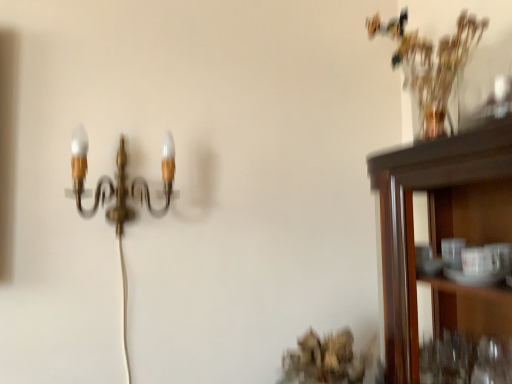
Question: Is translucent glass vase at upper right to the left of gold metallic wall sconce at upper left from the viewer's perspective?

Choices:
 (A) no
 (B) yes

Answer: (A)

Question: Is the depth of translucent glass vase at upper right less than that of gold metallic wall sconce at upper left?

Choices:
 (A) no
 (B) yes

Answer: (B)

Question: Can you confirm if translucent glass vase at upper right is shorter than gold metallic wall sconce at upper left?

Choices:
 (A) yes
 (B) no

Answer: (A)

Question: Does translucent glass vase at upper right have a greater height compared to gold metallic wall sconce at upper left?

Choices:
 (A) no
 (B) yes

Answer: (A)

Question: Is translucent glass vase at upper right to the right of gold metallic wall sconce at upper left from the viewer's perspective?

Choices:
 (A) no
 (B) yes

Answer: (B)

Question: From a real-world perspective, does translucent glass vase at upper right stand above gold metallic wall sconce at upper left?

Choices:
 (A) yes
 (B) no

Answer: (A)

Question: Is gold metallic wall sconce at upper left positioned with its back to translucent glass vase at upper right?

Choices:
 (A) no
 (B) yes

Answer: (A)

Question: Does gold metallic wall sconce at upper left have a greater width compared to translucent glass vase at upper right?

Choices:
 (A) no
 (B) yes

Answer: (B)

Question: From the image's perspective, is gold metallic wall sconce at upper left over translucent glass vase at upper right?

Choices:
 (A) no
 (B) yes

Answer: (A)

Question: Can we say gold metallic wall sconce at upper left lies outside translucent glass vase at upper right?

Choices:
 (A) yes
 (B) no

Answer: (A)

Question: Could you tell me if gold metallic wall sconce at upper left is facing translucent glass vase at upper right?

Choices:
 (A) yes
 (B) no

Answer: (B)

Question: From the image's perspective, is gold metallic wall sconce at upper left below translucent glass vase at upper right?

Choices:
 (A) yes
 (B) no

Answer: (A)

Question: From the image's perspective, is gold metallic wall sconce at upper left located above or below translucent glass vase at upper right?

Choices:
 (A) below
 (B) above

Answer: (A)